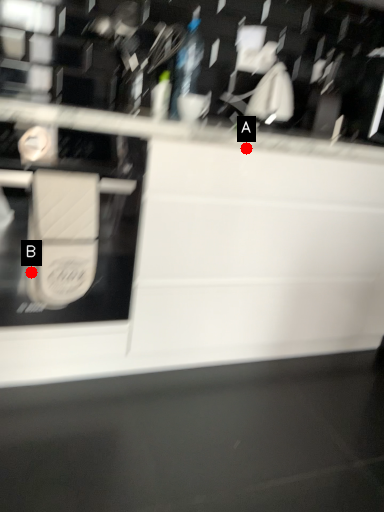
Question: Two points are circled on the image, labeled by A and B beside each circle. Which point is closer to the camera?

Choices:
 (A) A is closer
 (B) B is closer

Answer: (B)